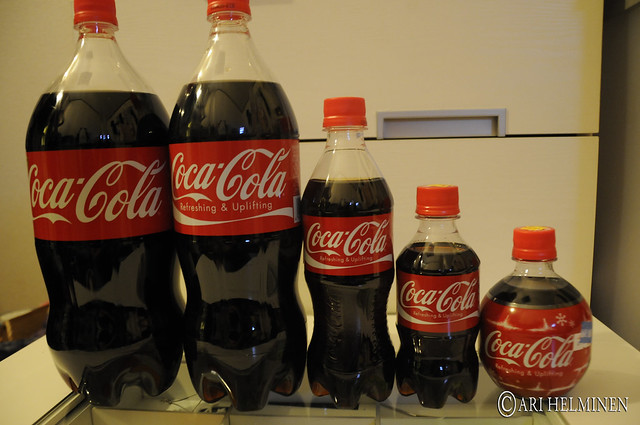
Where is `bottle of coca-cola`? The width and height of the screenshot is (640, 425). bottle of coca-cola is located at coordinates (96, 186), (358, 201), (233, 106), (445, 251), (532, 301).